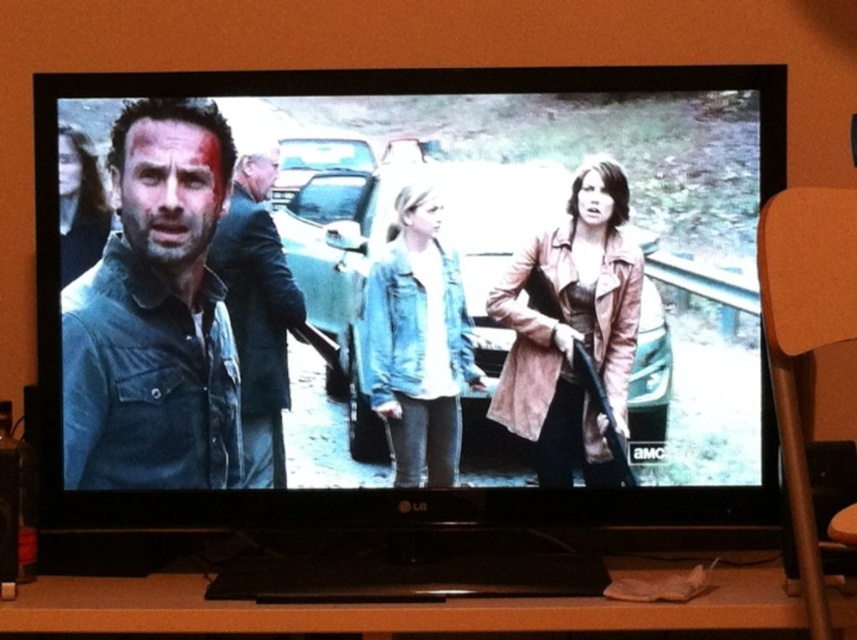
In the scene shown: Who is positioned more to the right, matte black jacket at center or denim jacket at left?

matte black jacket at center is more to the right.

Find the location of `matte black jacket at center`. matte black jacket at center is located at coordinates (411, 296).

Find the location of a particular element. The height and width of the screenshot is (640, 857). matte black jacket at center is located at coordinates (411, 296).

Between point (9, 621) and point (385, 426), which one is positioned in front?

Point (9, 621) is in front.

Between point (568, 627) and point (399, 336), which one is positioned behind?

Positioned behind is point (399, 336).

Is point (658, 608) positioned behind point (408, 355)?

No, it is in front of (408, 355).

I want to click on wooden entertainment center at lower center, so 405,605.

Is point (129, 452) farther from camera compared to point (661, 572)?

Yes.

Is point (139, 112) positioned after point (516, 628)?

Yes, it is behind point (516, 628).

At what (x,y) coordinates should I click in order to perform the action: click on dark blue denim shirt at left. Please return your answer as a coordinate pair (x, y). Looking at the image, I should click on (154, 316).